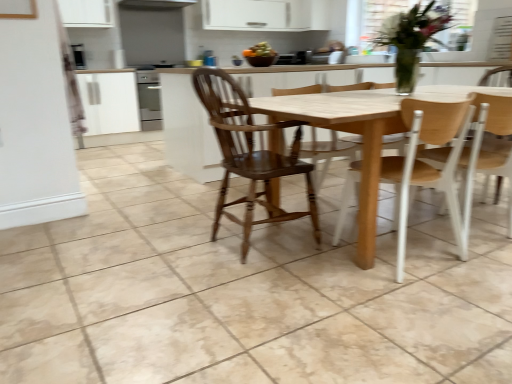
Where is `vacant region to the left of wooden chair at center, which appears as the 3th chair when viewed from the right`? vacant region to the left of wooden chair at center, which appears as the 3th chair when viewed from the right is located at coordinates (162, 249).